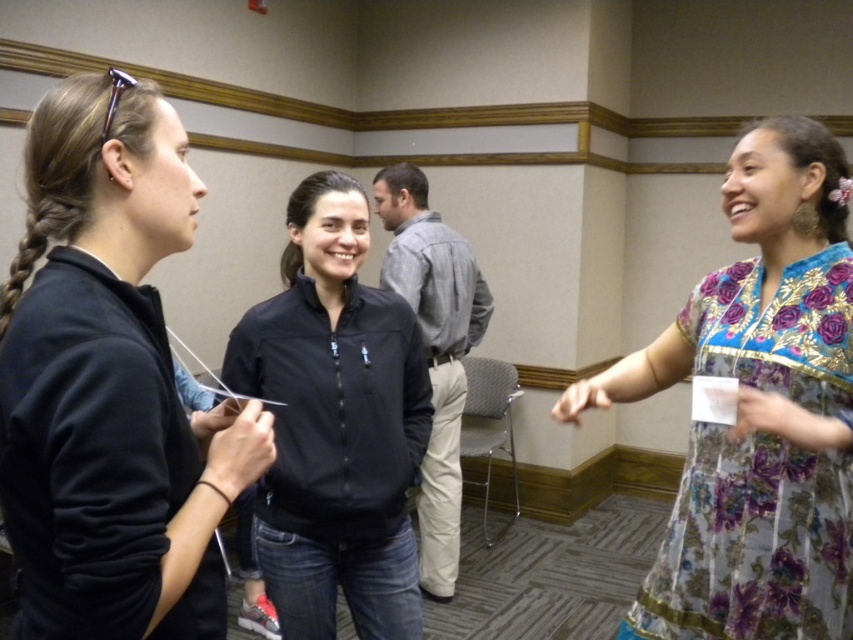
Question: Does matte black jacket at left appear under black softshell jacket at center?

Choices:
 (A) yes
 (B) no

Answer: (B)

Question: Considering the real-world distances, which object is closest to the black softshell jacket at center?

Choices:
 (A) matte black jacket at left
 (B) floral silk dress at right
 (C) gray cotton shirt at center

Answer: (B)

Question: Which point is farther to the camera?

Choices:
 (A) (375, 337)
 (B) (114, 214)
 (C) (805, 237)

Answer: (A)

Question: Which point is farther from the camera taking this photo?

Choices:
 (A) (421, 442)
 (B) (142, 147)

Answer: (A)

Question: Is matte black jacket at left below floral silk dress at right?

Choices:
 (A) no
 (B) yes

Answer: (A)

Question: Is matte black jacket at left further to the viewer compared to gray cotton shirt at center?

Choices:
 (A) yes
 (B) no

Answer: (B)